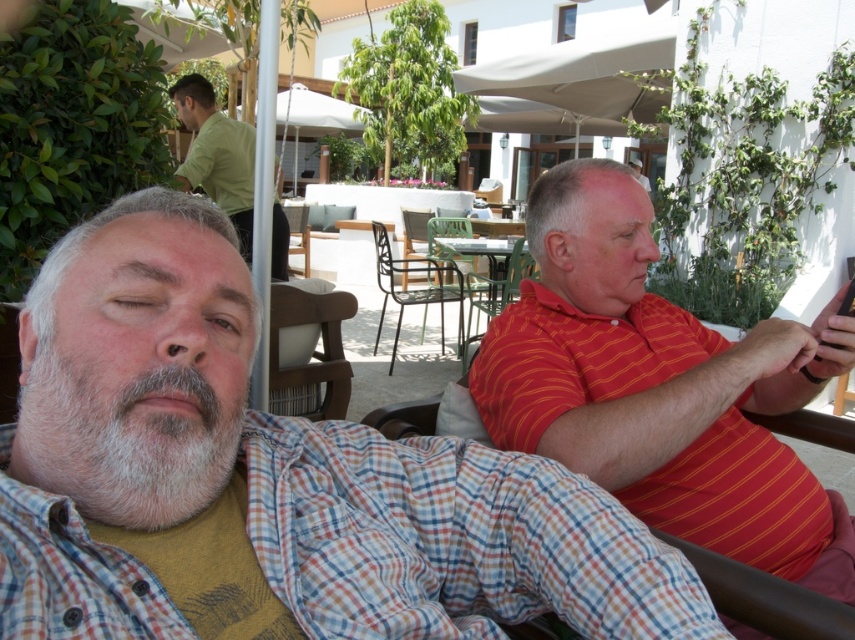
You are a person who is 1.8 meters tall and want to sit on one of the chairs at the center of the image. The metallic black chair at center and the metallic green chair at center are available. Which chair would you choose if you want to have more space for your legs?

The metallic green chair at center has a greater width than the metallic black chair at center, so choosing the metallic green chair at center would provide more legroom.

You are a delivery person who needs to place a package between the checkered shirt at center and the black wrought iron chair at center. The package requires 12 feet of space to be placed safely. Can you fit the package in that space?

The distance between the checkered shirt at center and the black wrought iron chair at center is 14.35 feet, which is more than enough to safely place the 12 feet required package.

You are a photographer trying to capture a photo of the checkered shirt at center and the black wrought iron chair at center. If you want to ensure both are fully visible in the frame, which object should you focus on first?

The checkered shirt at center is shorter than the black wrought iron chair at center, so you should focus on the checkered shirt at center first to ensure it is fully visible in the frame.